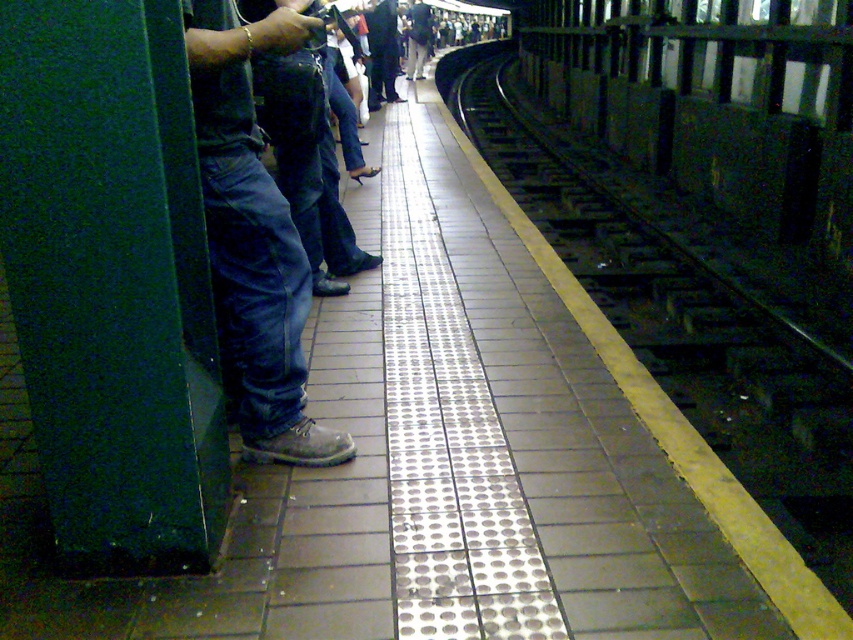
You are a photographer trying to capture the scene at the subway station platform. You notice two people wearing denim jeans at left and light gray pants at center. Which of these two individuals has a wider lower body clothing item?

The light gray pants at center has a greater width compared to the denim jeans at left, so the individual wearing light gray pants at center has a wider lower body clothing item.

You are a person standing on the subway platform. You want to know which of the two people, the one wearing denim jeans at left or the one wearing light gray pants at center, has clothing that reaches lower on their legs. Which one is it?

The denim jeans at left is shorter than light gray pants at center, so the denim jeans at left reaches lower on the legs.